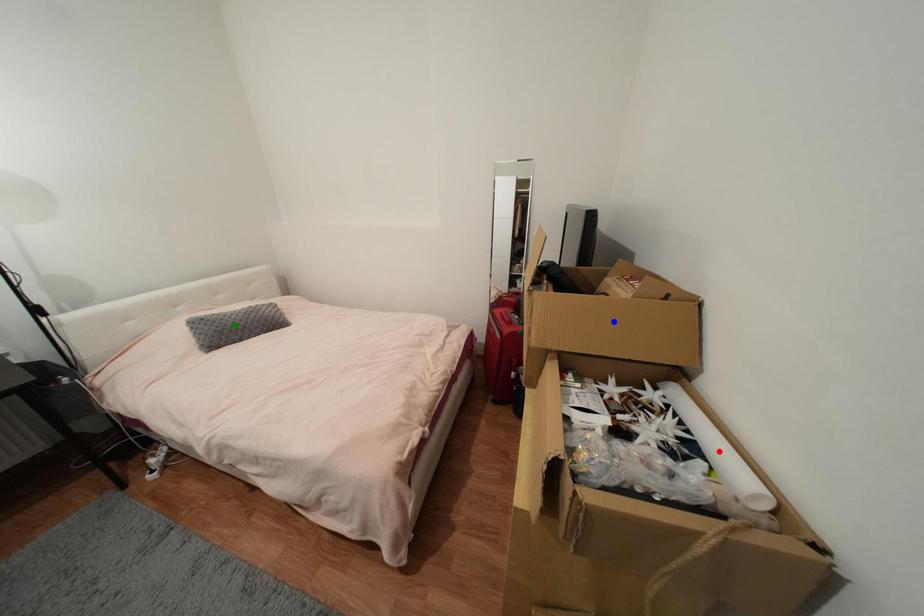
Order these from farthest to nearest:
A) red point
B) green point
C) blue point

green point
blue point
red point